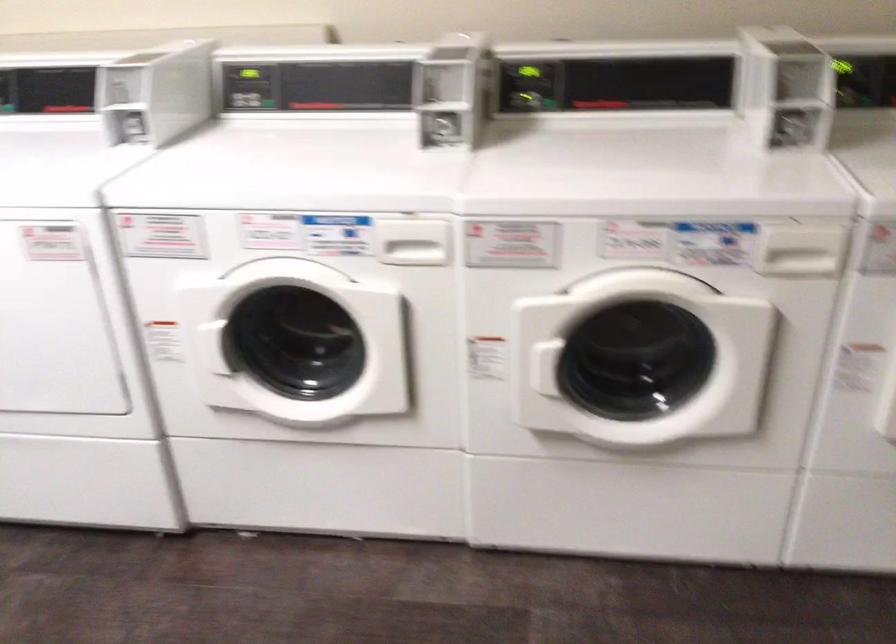
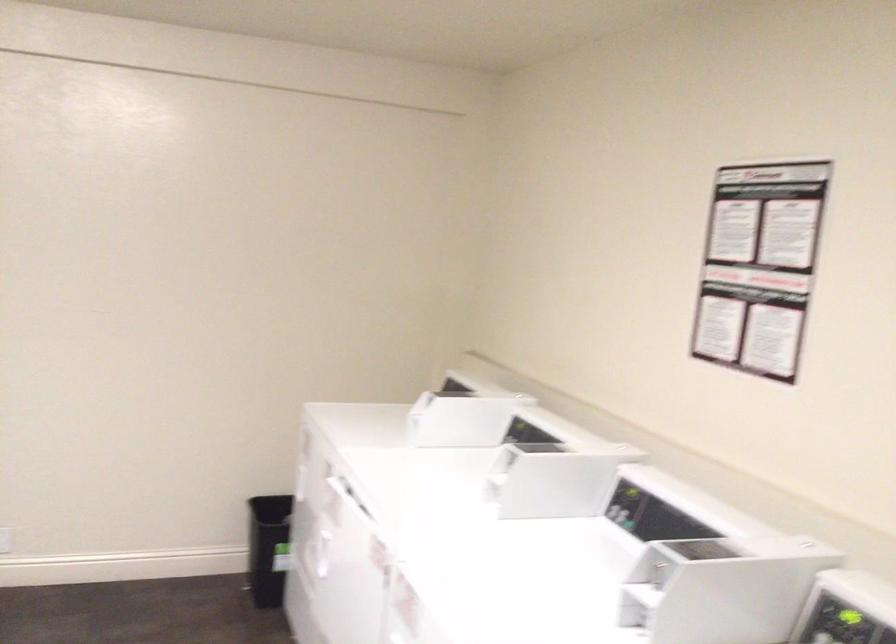
Question: Based on the continuous images, in which direction is the camera rotating? Reply with the corresponding letter.

Choices:
 (A) Left
 (B) Right
 (C) Up
 (D) Down

Answer: (A)